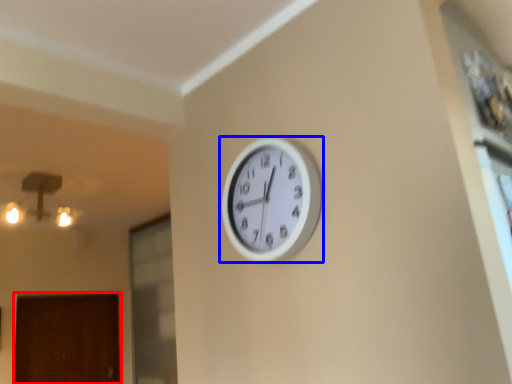
Question: Which object appears closest to the camera in this image, door (highlighted by a red box) or wall clock (highlighted by a blue box)?

Choices:
 (A) door
 (B) wall clock

Answer: (B)